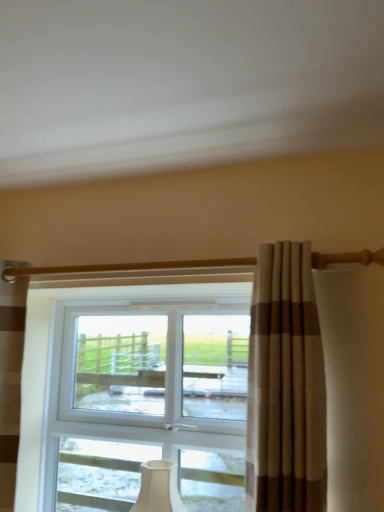
Question: From a real-world perspective, is brown striped curtain at left, marked as the 1th curtain in a left-to-right arrangement, positioned over white matte table lamp at center based on gravity?

Choices:
 (A) no
 (B) yes

Answer: (B)

Question: From a real-world perspective, is brown striped curtain at left, placed as the second curtain when sorted from front to back, under white matte table lamp at center?

Choices:
 (A) no
 (B) yes

Answer: (A)

Question: Is brown striped curtain at left, marked as the 1th curtain in a left-to-right arrangement, to the left of white matte table lamp at center from the viewer's perspective?

Choices:
 (A) yes
 (B) no

Answer: (A)

Question: Is brown striped curtain at left, marked as the 2th curtain in a right-to-left arrangement, further to camera compared to white matte table lamp at center?

Choices:
 (A) no
 (B) yes

Answer: (A)

Question: Is brown striped curtain at left, placed as the second curtain when sorted from front to back, placed right next to white matte table lamp at center?

Choices:
 (A) no
 (B) yes

Answer: (A)

Question: From the image's perspective, is brown striped curtain at left, which is counted as the 1th curtain, starting from the back, above white matte table lamp at center?

Choices:
 (A) yes
 (B) no

Answer: (A)

Question: Are white matte table lamp at center and beige striped curtain at center, which is the 1th curtain from front to back, beside each other?

Choices:
 (A) yes
 (B) no

Answer: (B)

Question: Is white matte table lamp at center facing away from beige striped curtain at center, the first curtain positioned from the right?

Choices:
 (A) no
 (B) yes

Answer: (A)

Question: Does white matte table lamp at center have a larger size compared to beige striped curtain at center, which is the 1th curtain from front to back?

Choices:
 (A) yes
 (B) no

Answer: (B)

Question: Is beige striped curtain at center, which is counted as the second curtain, starting from the left, a part of white matte table lamp at center?

Choices:
 (A) yes
 (B) no

Answer: (B)

Question: Does white matte table lamp at center have a lesser height compared to beige striped curtain at center, which is counted as the second curtain, starting from the back?

Choices:
 (A) no
 (B) yes

Answer: (B)

Question: Could you tell me if white matte table lamp at center is turned towards beige striped curtain at center, which is the 1th curtain from front to back?

Choices:
 (A) no
 (B) yes

Answer: (A)

Question: Would you say brown striped curtain at left, placed as the second curtain when sorted from front to back, is part of beige striped curtain at center, which is counted as the second curtain, starting from the back,'s contents?

Choices:
 (A) no
 (B) yes

Answer: (A)